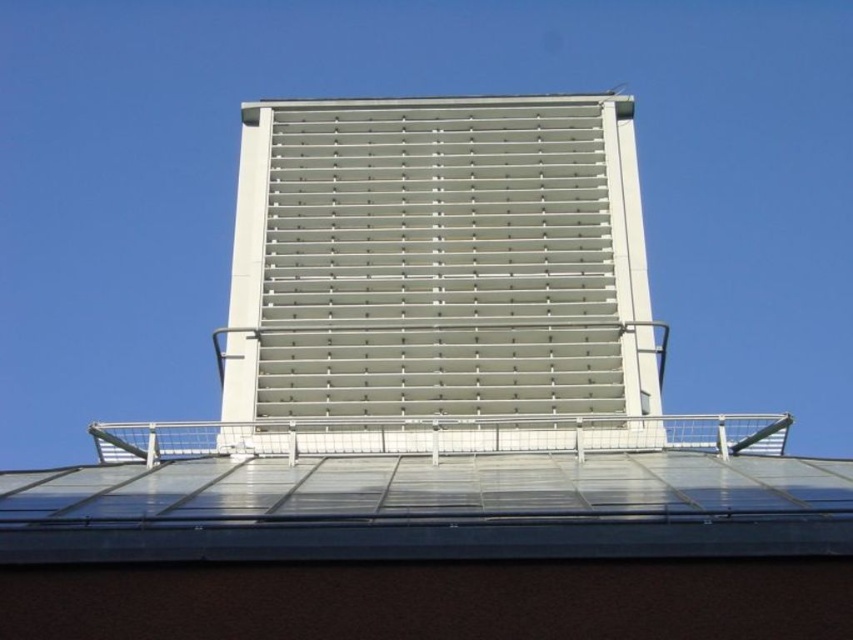
From the picture: You are an architect inspecting the building facade. You notice the white metallic slats at center and the transparent glass roof at center. Which of these two elements is positioned higher in the vertical plane?

The white metallic slats at center are taller than the transparent glass roof at center, so the white metallic slats at center are positioned higher in the vertical plane.

You are standing on the ground looking up at the building. Which object is to the left of the other between the white metallic slats at center and the transparent glass roof at center?

The transparent glass roof at center is to the left of the white metallic slats at center because the white metallic slats at center is positioned on the right side of transparent glass roof at center.